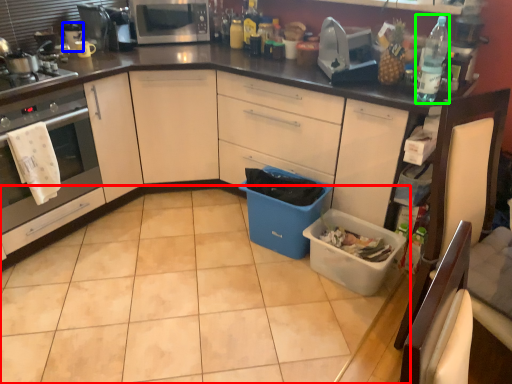
Question: Which object is the farthest from tile (highlighted by a red box)? Choose among these: appliance (highlighted by a blue box) or bottle (highlighted by a green box).

Choices:
 (A) appliance
 (B) bottle

Answer: (A)